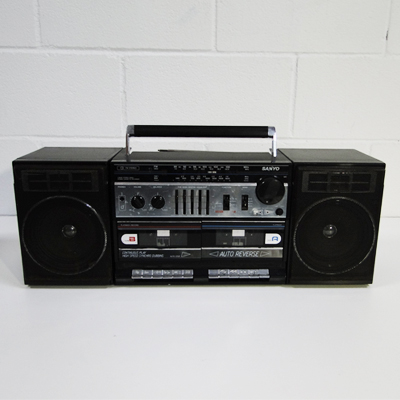
Image resolution: width=400 pixels, height=400 pixels. Find the location of `power or volume dial`. power or volume dial is located at coordinates (270, 189).